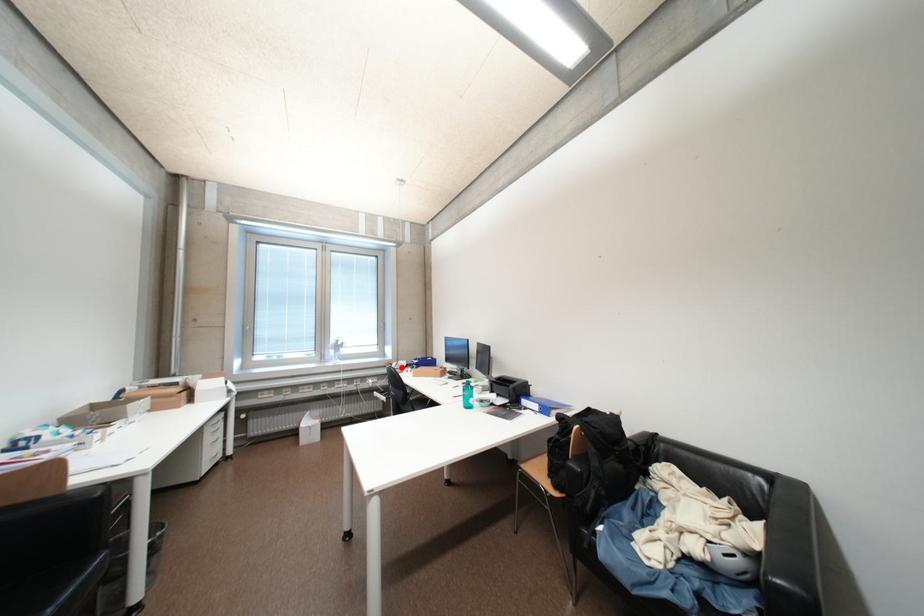
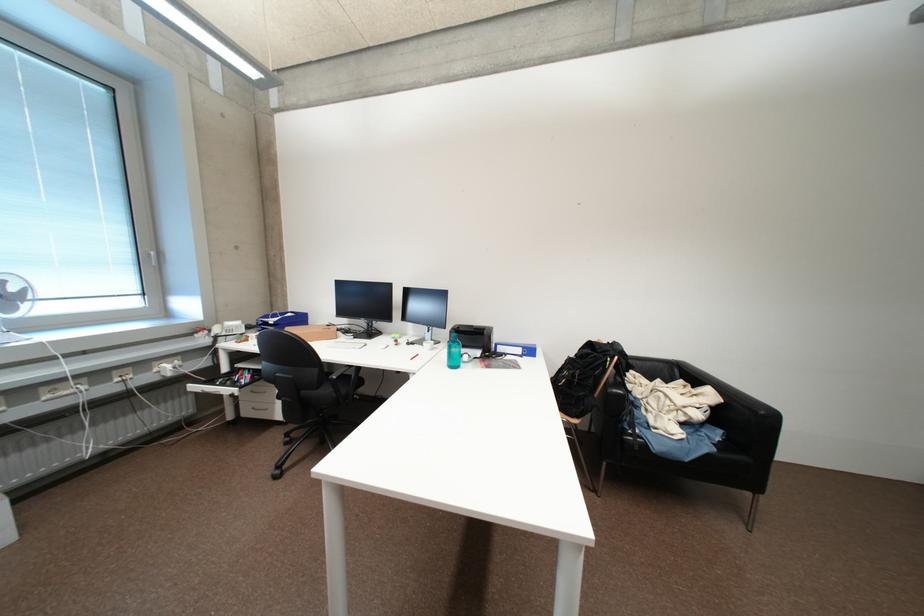
Question: I am providing you with two images of the same scene from different viewpoints. Image1 has a red point marked. In image2, the corresponding 3D location appears at what relative position? Reply with the corresponding letter.

Choices:
 (A) Closer
 (B) Farther

Answer: (A)